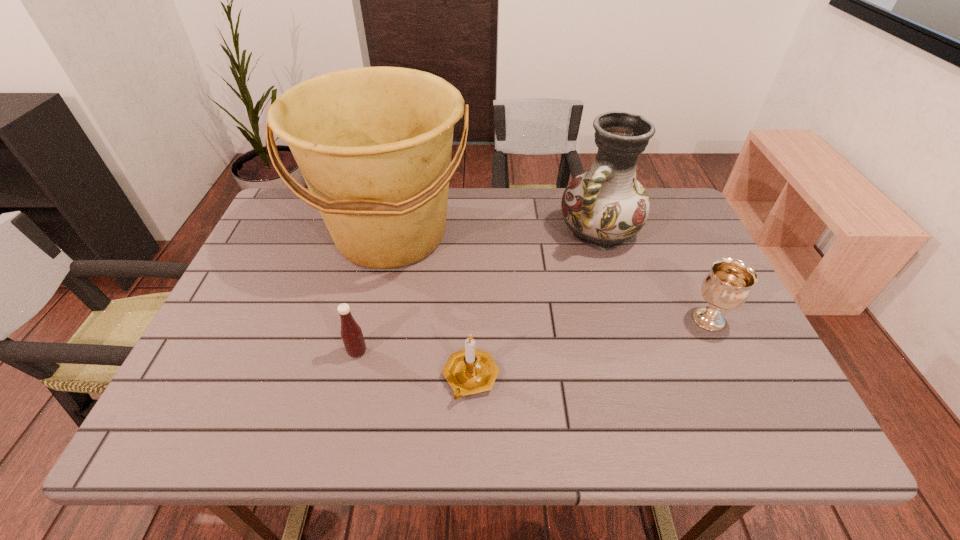
Identify the location of free space between the bucket and the third farthest object. (550, 277).

This screenshot has width=960, height=540. I want to click on free space between the fourth object from left to right and the rightmost object, so click(x=654, y=276).

You are a GUI agent. You are given a task and a screenshot of the screen. Output one action in this format:
    pyautogui.click(x=<x>, y=<y>)
    Task: Click on the blank region between the third nearest object and the fourth shortest object
    This screenshot has height=540, width=960.
    Given the screenshot: What is the action you would take?
    pyautogui.click(x=654, y=276)

Image resolution: width=960 pixels, height=540 pixels. What are the coordinates of `vacant space in between the bucket and the fourth shortest object` in the screenshot? It's located at (495, 234).

Find the location of a particular element. The width and height of the screenshot is (960, 540). vacant area between the Tabasco sauce and the vase is located at coordinates (478, 292).

I want to click on vacant space in between the candle holder and the Tabasco sauce, so click(414, 364).

Identify the location of the third closest object to the candle holder. The image size is (960, 540). (605, 206).

Locate an element on the screen. This screenshot has height=540, width=960. the second closest object relative to the Tabasco sauce is located at coordinates (469, 371).

You are a GUI agent. You are given a task and a screenshot of the screen. Output one action in this format:
    pyautogui.click(x=<x>, y=<y>)
    Task: Click on the free space that satisfies the following two spatial constraints: 1. on the back side of the vase; 2. on the right side of the Tabasco sauce
    This screenshot has height=540, width=960.
    Given the screenshot: What is the action you would take?
    pyautogui.click(x=386, y=233)